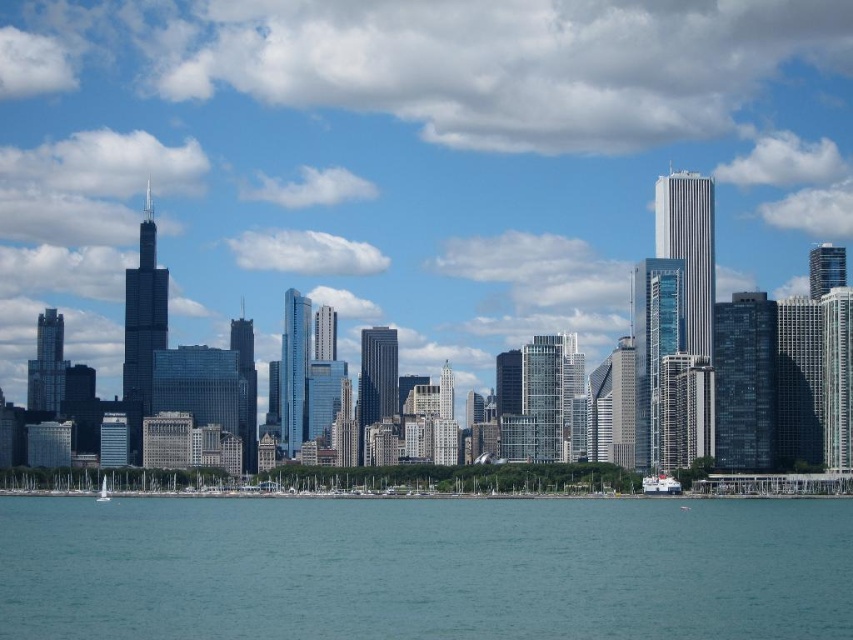
Is point (648, 520) positioned after point (103, 476)?

No.

Which is more to the right, blue water at lower center or white glossy sailboat at lower left?

blue water at lower center

Is point (590, 596) closer to camera compared to point (97, 499)?

Yes.

Image resolution: width=853 pixels, height=640 pixels. What are the coordinates of `blue water at lower center` in the screenshot? It's located at (424, 568).

Is blue water at lower center positioned before white matte boat at lower right?

That is True.

Who is taller, blue water at lower center or white matte boat at lower right?

With more height is blue water at lower center.

At what (x,y) coordinates should I click in order to perform the action: click on blue water at lower center. Please return your answer as a coordinate pair (x, y). The width and height of the screenshot is (853, 640). Looking at the image, I should click on (424, 568).

Is white matte boat at lower right to the right of white glossy sailboat at lower left from the viewer's perspective?

Indeed, white matte boat at lower right is positioned on the right side of white glossy sailboat at lower left.

Is the position of white matte boat at lower right less distant than that of white glossy sailboat at lower left?

Yes, it is.

Who is more forward, (x=659, y=490) or (x=106, y=483)?

Point (x=659, y=490) is more forward.

I want to click on white matte boat at lower right, so click(660, 484).